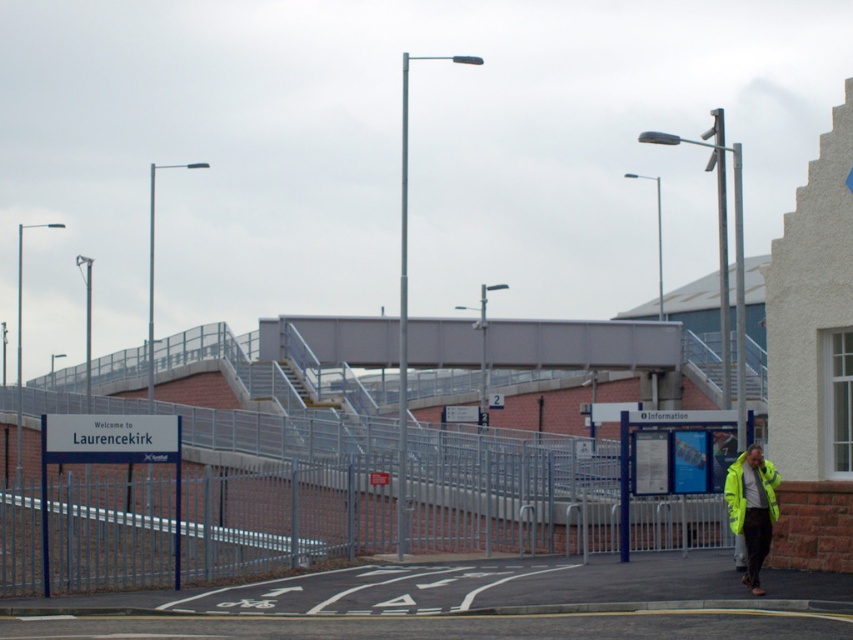
Question: Where is metallic silver fence at center located in relation to high visibility yellow jacket at lower right in the image?

Choices:
 (A) below
 (B) above

Answer: (A)

Question: Which of the following is the farthest from the observer?

Choices:
 (A) (70, 512)
 (B) (766, 477)

Answer: (A)

Question: Is metallic silver fence at center in front of high visibility yellow jacket at lower right?

Choices:
 (A) yes
 (B) no

Answer: (B)

Question: Which of the following is the closest to the observer?

Choices:
 (A) (734, 500)
 (B) (602, 484)

Answer: (A)

Question: Considering the relative positions of metallic silver fence at center and high visibility yellow jacket at lower right in the image provided, where is metallic silver fence at center located with respect to high visibility yellow jacket at lower right?

Choices:
 (A) right
 (B) left

Answer: (B)